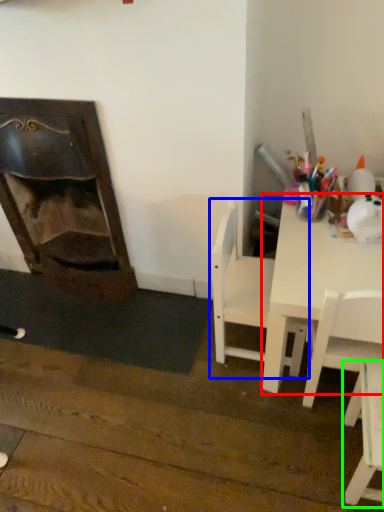
Question: Which object is positioned farthest from table (highlighted by a red box)? Select from chair (highlighted by a blue box) and chair (highlighted by a green box).

Choices:
 (A) chair
 (B) chair

Answer: (B)